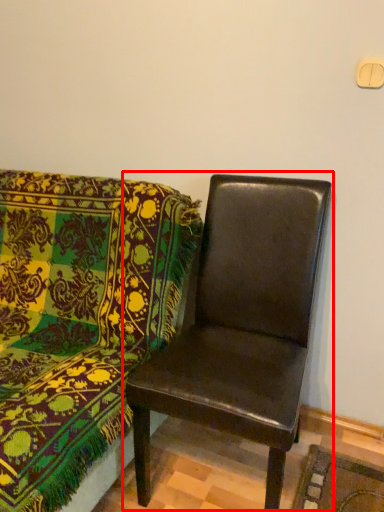
Question: From the image's perspective, what is the correct spatial relationship of chair (annotated by the red box) in relation to chair?

Choices:
 (A) above
 (B) below

Answer: (B)